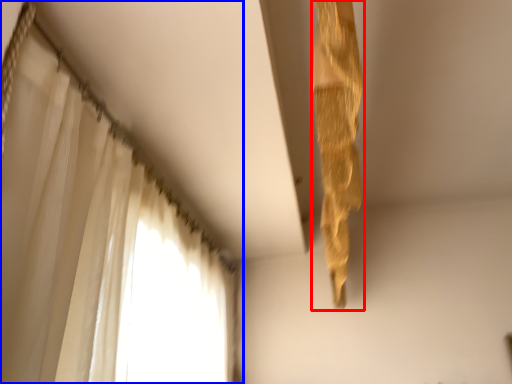
Question: Which point is further to the camera, curtain (highlighted by a red box) or curtain (highlighted by a blue box)?

Choices:
 (A) curtain
 (B) curtain

Answer: (A)